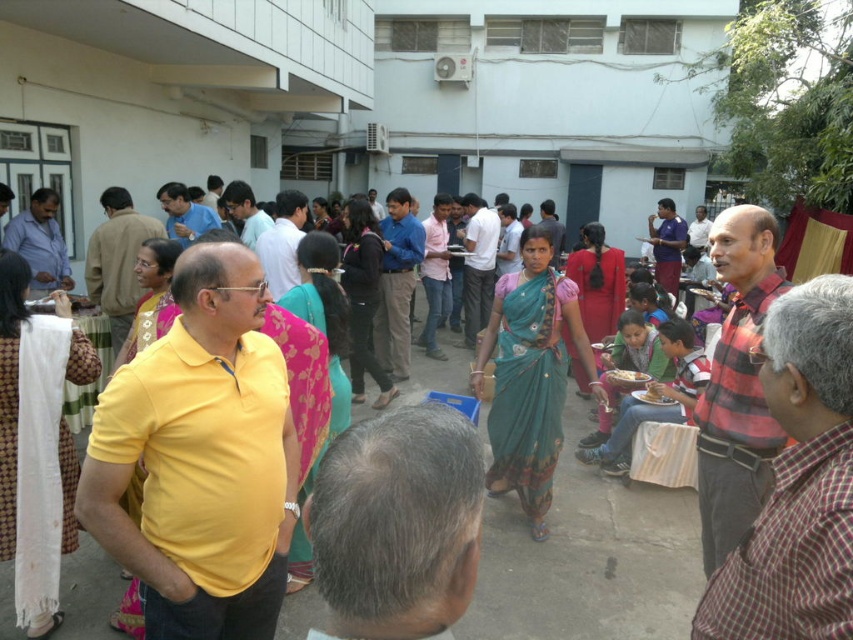
Is green sari at center positioned at the back of white ceramic bowl at center?

No, green sari at center is in front of white ceramic bowl at center.

Who is positioned more to the right, green sari at center or white ceramic bowl at center?

Positioned to the right is white ceramic bowl at center.

The width and height of the screenshot is (853, 640). I want to click on green sari at center, so click(589, 560).